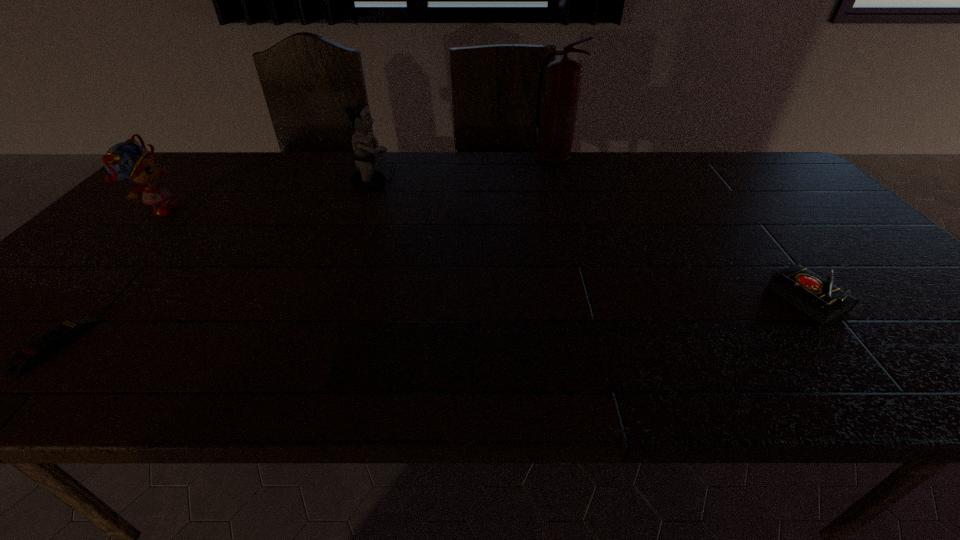
What are the coordinates of `the second object from right to left` in the screenshot? It's located at (564, 76).

At what (x,y) coordinates should I click in order to perform the action: click on the tallest object. Please return your answer as a coordinate pair (x, y). The height and width of the screenshot is (540, 960). Looking at the image, I should click on (564, 76).

Find the location of a particular element. The height and width of the screenshot is (540, 960). the fourth shortest object is located at coordinates (367, 179).

At what (x,y) coordinates should I click in order to perform the action: click on figurine. Please return your answer as a coordinate pair (x, y). Looking at the image, I should click on (367, 179).

Image resolution: width=960 pixels, height=540 pixels. In order to click on doll in this screenshot , I will do `click(128, 161)`.

Locate an element on the screen. This screenshot has width=960, height=540. diary is located at coordinates (819, 299).

This screenshot has width=960, height=540. In order to click on the second shortest object in this screenshot , I will do `click(819, 299)`.

Identify the location of free point located on the handle side the second object from right to left. (683, 162).

Locate an element on the screen. The image size is (960, 540). vacant area situated 0.220m on the front-facing side of the second tallest object is located at coordinates (463, 185).

The image size is (960, 540). Find the location of `vacant space situated 0.400m on the face of the third tallest object`. vacant space situated 0.400m on the face of the third tallest object is located at coordinates click(x=318, y=211).